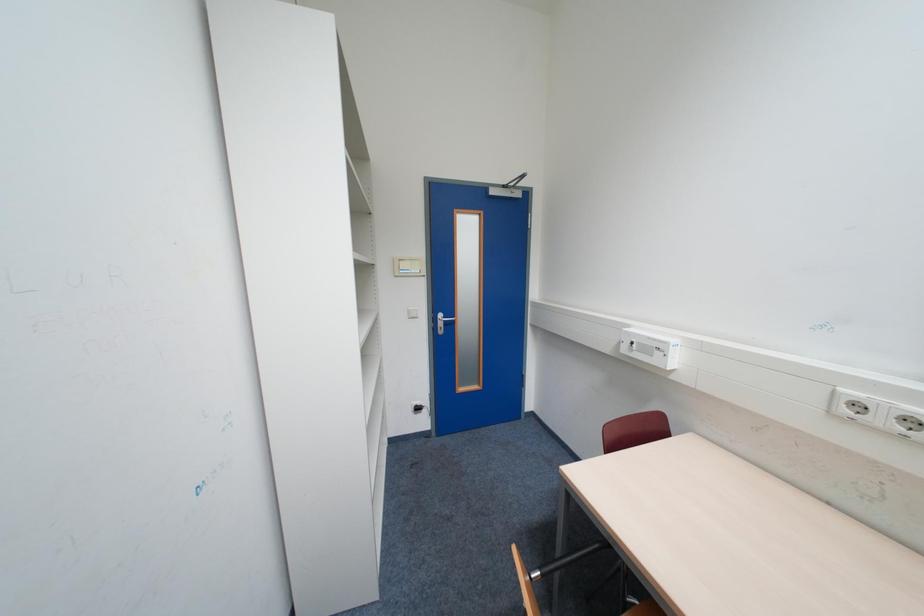
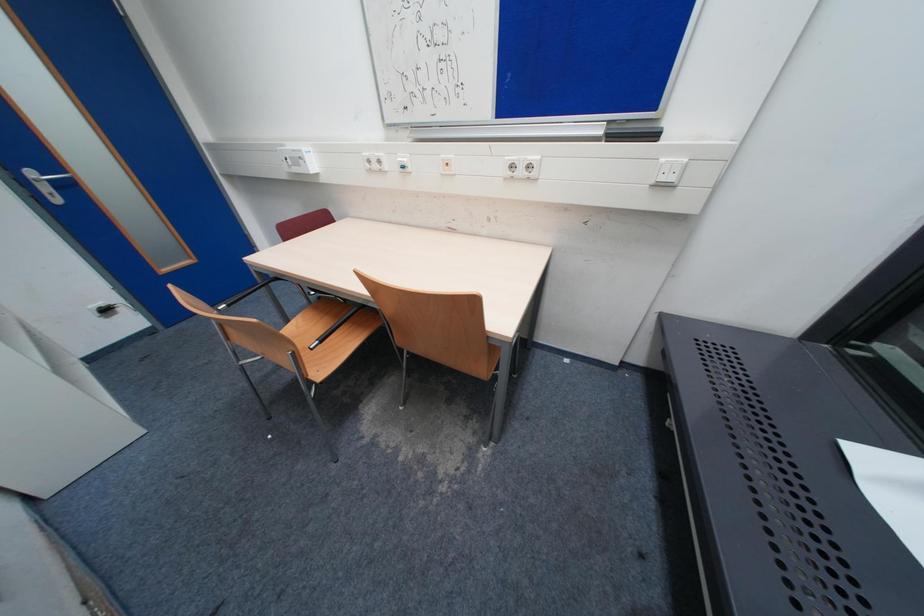
The images are taken continuously from a first-person perspective. In which direction is your viewpoint rotating?

The camera's rotation is toward right-down.